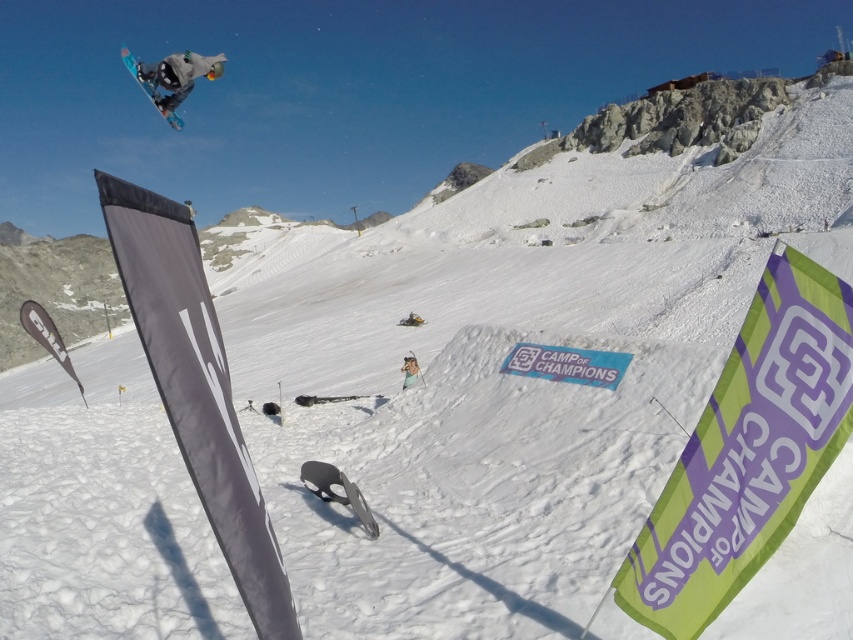
From the picture: You are a photographer standing at the camera position. You want to take a photo focusing on the snowboarder and the two points marked in the scene. Which point, point (177, 65) or point (173, 116), is closer to you?

Point (177, 65) is closer to you than point (173, 116).